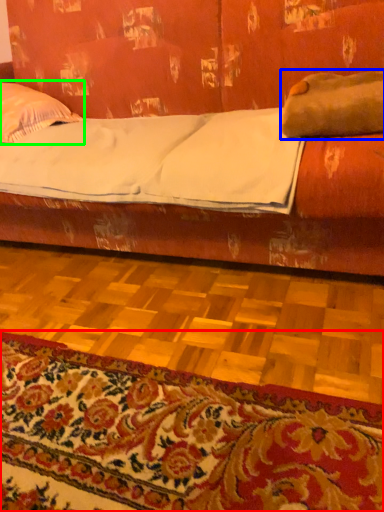
Question: Which is farther away from mat (highlighted by a red box)? pillow (highlighted by a blue box) or pillow (highlighted by a green box)?

Choices:
 (A) pillow
 (B) pillow

Answer: (B)